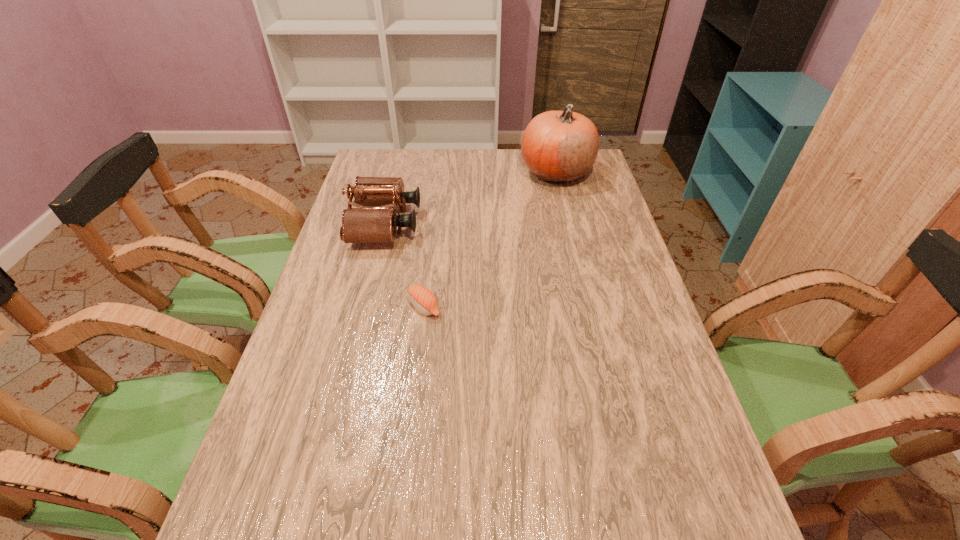
Image resolution: width=960 pixels, height=540 pixels. Identify the location of object that is at the left edge. (364, 224).

Where is `object located at the right edge`? This screenshot has width=960, height=540. object located at the right edge is located at coordinates (557, 146).

You are a GUI agent. You are given a task and a screenshot of the screen. Output one action in this format:
    pyautogui.click(x=<x>, y=<y>)
    Task: Click on the object at the far right corner
    The image size is (960, 540).
    Given the screenshot: What is the action you would take?
    pyautogui.click(x=557, y=146)

Locate an element on the screen. free region at the far edge of the desktop is located at coordinates (446, 163).

Identify the location of free space at the left edge of the desktop. (307, 336).

The width and height of the screenshot is (960, 540). I want to click on free space at the right edge of the desktop, so click(x=601, y=314).

In the image, there is a desktop. Identify the location of free space at the far left corner. (392, 166).

Find the location of a particular element. empty space that is in between the nearest object and the binoculars is located at coordinates click(404, 265).

This screenshot has height=540, width=960. I want to click on vacant space that is in between the shortest object and the binoculars, so click(404, 265).

Locate an element on the screen. The height and width of the screenshot is (540, 960). unoccupied position between the nearest object and the binoculars is located at coordinates (404, 265).